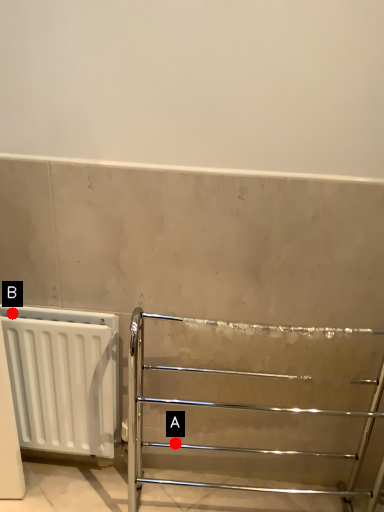
Question: Two points are circled on the image, labeled by A and B beside each circle. Which of the following is the farthest from the observer?

Choices:
 (A) A is further
 (B) B is further

Answer: (A)